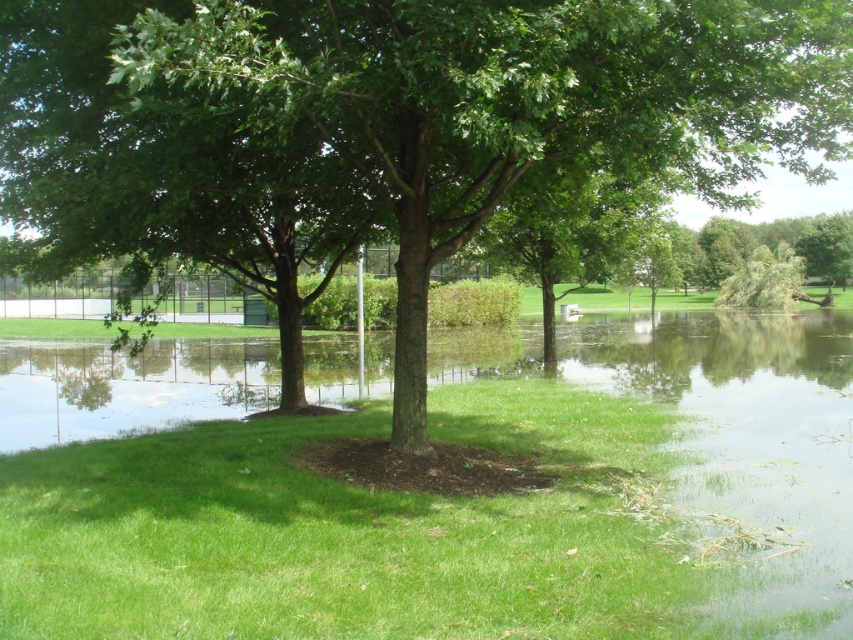
Question: Can you confirm if green leafy tree at center is bigger than green leafy tree at right?

Choices:
 (A) no
 (B) yes

Answer: (B)

Question: Which object is farther from the camera taking this photo?

Choices:
 (A) green leafy tree at center
 (B) green leafy tree at right

Answer: (B)

Question: Can you confirm if green leafy tree at center is positioned to the left of green leafy tree at right?

Choices:
 (A) yes
 (B) no

Answer: (A)

Question: Is green leafy tree at center to the left of green leafy tree at right from the viewer's perspective?

Choices:
 (A) no
 (B) yes

Answer: (B)

Question: Among these points, which one is nearest to the camera?

Choices:
 (A) (64, 33)
 (B) (839, 244)

Answer: (A)